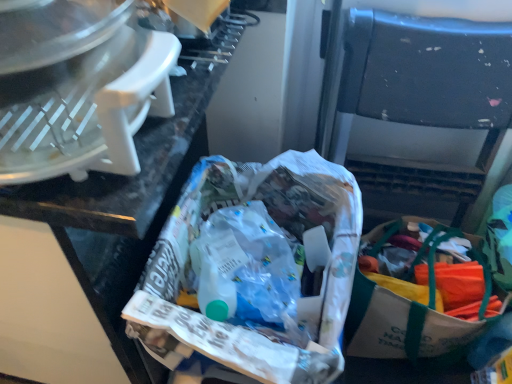
What is the approximate width of white canvas bag with green straps at lower right?

The width of white canvas bag with green straps at lower right is 14.51 inches.

This screenshot has width=512, height=384. What do you see at coordinates (280, 226) in the screenshot?
I see `white paper bag at center` at bounding box center [280, 226].

Where is `white plastic food processor at upper left`? The height and width of the screenshot is (384, 512). white plastic food processor at upper left is located at coordinates (77, 88).

From the image's perspective, is white canvas bag with green straps at lower right located above or below white paper bag at center?

white canvas bag with green straps at lower right is below white paper bag at center.

Which is nearer, (411, 328) or (146, 266)?

Point (146, 266)

In the scene shown: Could you tell me if white canvas bag with green straps at lower right is turned towards white paper bag at center?

No, white canvas bag with green straps at lower right does not turn towards white paper bag at center.

Does white canvas bag with green straps at lower right appear on the right side of white paper bag at center?

Indeed, white canvas bag with green straps at lower right is positioned on the right side of white paper bag at center.

Would you say black plastic folding chair at center is part of white plastic food processor at upper left's contents?

No, black plastic folding chair at center is not inside white plastic food processor at upper left.

Is white plastic food processor at upper left at the left side of black plastic folding chair at center?

Correct, you'll find white plastic food processor at upper left to the left of black plastic folding chair at center.

From the image's perspective, is white plastic food processor at upper left beneath black plastic folding chair at center?

Indeed, from the image's perspective, white plastic food processor at upper left is shown beneath black plastic folding chair at center.

Does black plastic folding chair at center touch white canvas bag with green straps at lower right?

No, black plastic folding chair at center is not making contact with white canvas bag with green straps at lower right.

Who is bigger, black plastic folding chair at center or white canvas bag with green straps at lower right?

white canvas bag with green straps at lower right is bigger.

Between point (351, 16) and point (463, 331), which one is positioned in front?

The point (351, 16) is in front.

Would you say black plastic folding chair at center is to the left or to the right of white canvas bag with green straps at lower right in the picture?

black plastic folding chair at center is to the right of white canvas bag with green straps at lower right.

Is white canvas bag with green straps at lower right closer to the viewer compared to white plastic food processor at upper left?

No, white canvas bag with green straps at lower right is further to the viewer.

From the picture: From a real-world perspective, which object rests below the other?

From a 3D spatial view, white canvas bag with green straps at lower right is below.

From the image's perspective, is white canvas bag with green straps at lower right located above white plastic food processor at upper left?

No, from the image's perspective, white canvas bag with green straps at lower right is not above white plastic food processor at upper left.

Is the surface of white canvas bag with green straps at lower right in direct contact with white plastic food processor at upper left?

No, white canvas bag with green straps at lower right is not making contact with white plastic food processor at upper left.

From their relative heights in the image, would you say black plastic folding chair at center is taller or shorter than white paper bag at center?

Considering their sizes, black plastic folding chair at center has more height than white paper bag at center.

Is black plastic folding chair at center wider or thinner than white paper bag at center?

Clearly, black plastic folding chair at center has less width compared to white paper bag at center.

From a real-world perspective, who is located lower, black plastic folding chair at center or white paper bag at center?

black plastic folding chair at center is physically lower.

From the image's perspective, is black plastic folding chair at center on top of white paper bag at center?

Correct, black plastic folding chair at center appears higher than white paper bag at center in the image.

Which object is further away from the camera taking this photo, white paper bag at center or black plastic folding chair at center?

black plastic folding chair at center is further from the camera.

Does white paper bag at center have a smaller size compared to black plastic folding chair at center?

No, white paper bag at center is not smaller than black plastic folding chair at center.

Considering the relative sizes of white paper bag at center and black plastic folding chair at center in the image provided, is white paper bag at center shorter than black plastic folding chair at center?

Yes, white paper bag at center is shorter than black plastic folding chair at center.

Based on their positions, is white paper bag at center located to the left or right of black plastic folding chair at center?

white paper bag at center is to the left of black plastic folding chair at center.

Find the location of a particular element. folding chair that is above the white plastic food processor at upper left (from the image's perspective) is located at coordinates (x=425, y=76).

Based on the photo, which of these two, black plastic folding chair at center or white plastic food processor at upper left, stands shorter?

white plastic food processor at upper left is shorter.

From the image's perspective, is black plastic folding chair at center beneath white plastic food processor at upper left?

No, from the image's perspective, black plastic folding chair at center is not beneath white plastic food processor at upper left.

At what (x,y) coordinates should I click in order to perform the action: click on material above the white canvas bag with green straps at lower right (from the image's perspective). Please return your answer as a coordinate pair (x, y). The width and height of the screenshot is (512, 384). Looking at the image, I should click on (280, 226).

This screenshot has height=384, width=512. Find the location of `kitchen appliance that appears in front of the black plastic folding chair at center`. kitchen appliance that appears in front of the black plastic folding chair at center is located at coordinates (77, 88).

Considering their positions, is white paper bag at center positioned further to white canvas bag with green straps at lower right than white plastic food processor at upper left?

white plastic food processor at upper left lies further to white canvas bag with green straps at lower right than the other object.

Estimate the real-world distances between objects in this image. Which object is closer to white paper bag at center, white canvas bag with green straps at lower right or white plastic food processor at upper left?

Based on the image, white plastic food processor at upper left appears to be nearer to white paper bag at center.

When comparing their distances from white canvas bag with green straps at lower right, does white plastic food processor at upper left or black plastic folding chair at center seem closer?

black plastic folding chair at center is closer to white canvas bag with green straps at lower right.

Estimate the real-world distances between objects in this image. Which object is closer to white paper bag at center, white plastic food processor at upper left or black plastic folding chair at center?

Among the two, white plastic food processor at upper left is located nearer to white paper bag at center.

Estimate the real-world distances between objects in this image. Which object is further from white plastic food processor at upper left, white paper bag at center or black plastic folding chair at center?

The object further to white plastic food processor at upper left is black plastic folding chair at center.

When comparing their distances from white canvas bag with green straps at lower right, does black plastic folding chair at center or white paper bag at center seem further?

white paper bag at center is further to white canvas bag with green straps at lower right.

Which object lies nearer to the anchor point white paper bag at center, black plastic folding chair at center or white plastic food processor at upper left?

The object closer to white paper bag at center is white plastic food processor at upper left.

Estimate the real-world distances between objects in this image. Which object is closer to black plastic folding chair at center, white plastic food processor at upper left or white canvas bag with green straps at lower right?

white canvas bag with green straps at lower right is closer to black plastic folding chair at center.

The height and width of the screenshot is (384, 512). I want to click on material between white plastic food processor at upper left and white canvas bag with green straps at lower right in the horizontal direction, so click(x=280, y=226).

The height and width of the screenshot is (384, 512). In order to click on shopping bag between white plastic food processor at upper left and black plastic folding chair at center from left to right in this screenshot , I will do `click(402, 326)`.

Find the location of `shopping bag between white paper bag at center and black plastic folding chair at center in the horizontal direction`. shopping bag between white paper bag at center and black plastic folding chair at center in the horizontal direction is located at coordinates (402, 326).

This screenshot has height=384, width=512. In order to click on material between white plastic food processor at upper left and black plastic folding chair at center in this screenshot , I will do `click(280, 226)`.